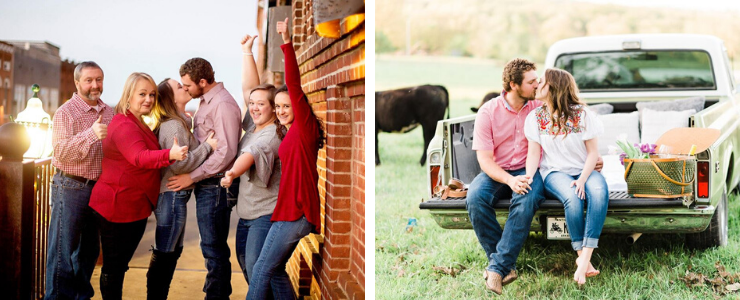
Identify the location of pillows. Image resolution: width=740 pixels, height=300 pixels. (659, 123), (618, 126).